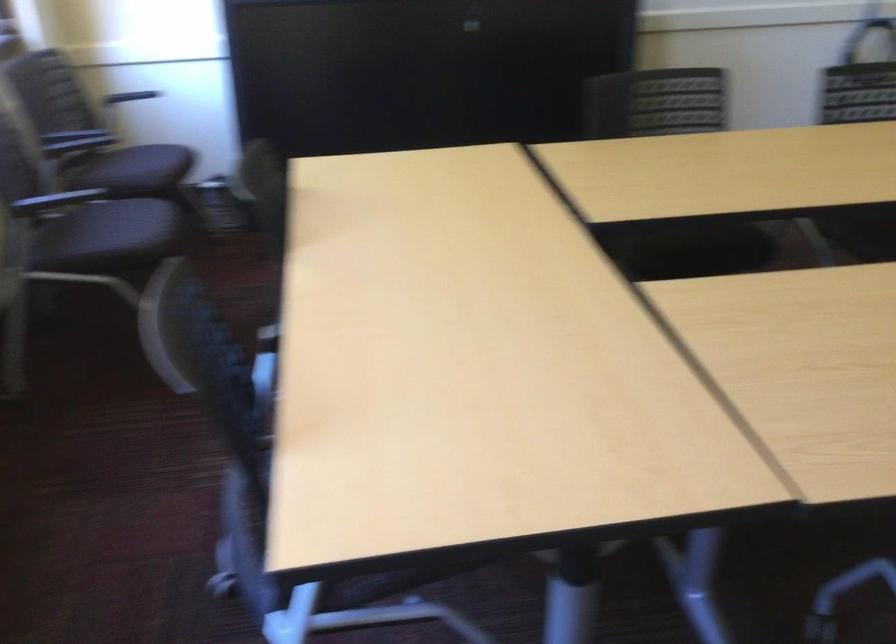
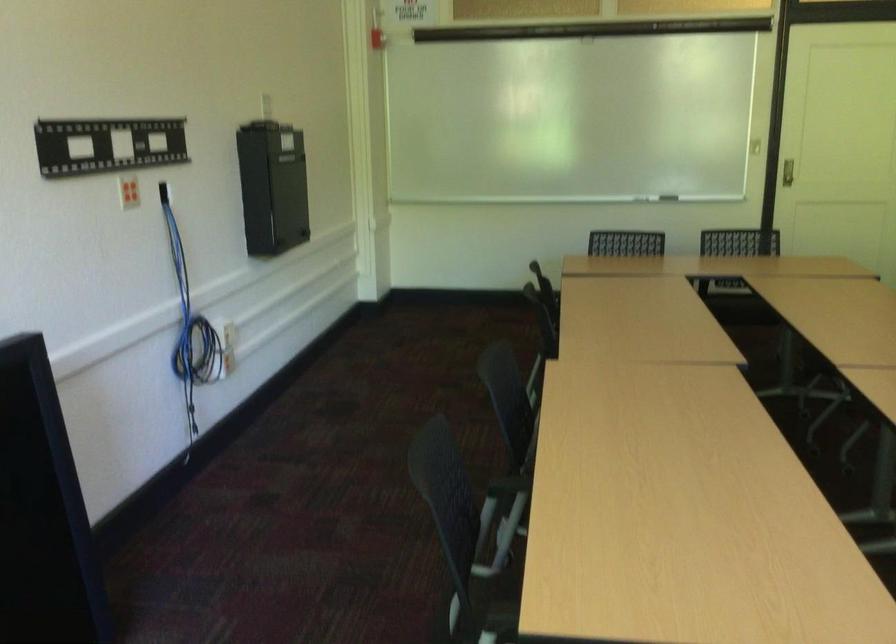
The point at [747,147] is marked in the first image. Where is the corresponding point in the second image?

(506, 486)